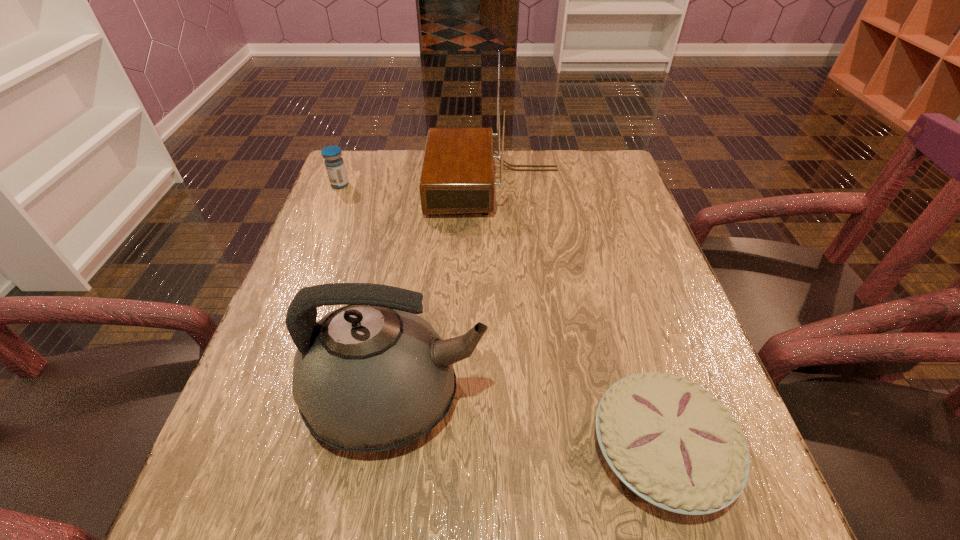
The width and height of the screenshot is (960, 540). In order to click on unoccupied position between the pie and the kettle in this screenshot , I will do `click(529, 424)`.

Where is `empty space that is in between the shortest object and the radio_receiver`? empty space that is in between the shortest object and the radio_receiver is located at coordinates (578, 317).

You are a GUI agent. You are given a task and a screenshot of the screen. Output one action in this format:
    pyautogui.click(x=<x>, y=<y>)
    Task: Click on the vacant space that is in between the radio_receiver and the kettle
    The height and width of the screenshot is (540, 960).
    Given the screenshot: What is the action you would take?
    pyautogui.click(x=445, y=291)

The image size is (960, 540). Identify the location of free space that is in between the leftmost object and the shortest object. (500, 317).

Find the location of `object that is the closest to the medicine`. object that is the closest to the medicine is located at coordinates tap(457, 177).

You are a GUI agent. You are given a task and a screenshot of the screen. Output one action in this format:
    pyautogui.click(x=<x>, y=<y>)
    Task: Click on the object identified as the third closest to the leftmost object
    
    Given the screenshot: What is the action you would take?
    pyautogui.click(x=672, y=443)

In order to click on free spot that satisfies the following two spatial constraints: 1. on the back side of the shortest object; 2. at the spout of the kettle in this screenshot , I will do `click(646, 398)`.

What are the coordinates of `free space that satisfies the following two spatial constraints: 1. on the front panel of the radio_receiver; 2. on the front side of the leftmost object` in the screenshot? It's located at point(494,185).

Identify the location of vacant region that satisfies the following two spatial constraints: 1. on the front panel of the pie; 2. on the right side of the radio_receiver. (505, 449).

Where is `vacant area in the image that satisfies the following two spatial constraints: 1. on the front panel of the pie; 2. on the right side of the radio_receiver`? vacant area in the image that satisfies the following two spatial constraints: 1. on the front panel of the pie; 2. on the right side of the radio_receiver is located at coordinates (505, 449).